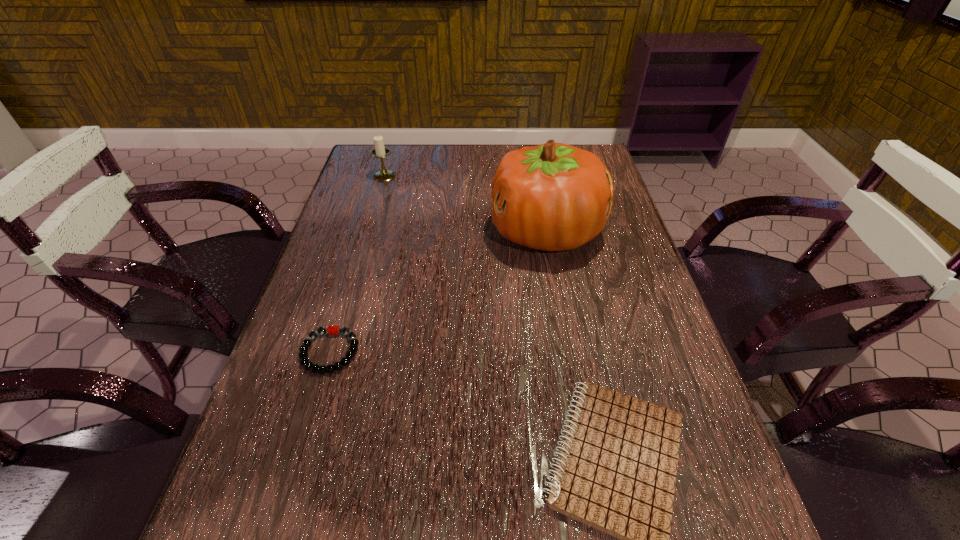
Identify the location of vacant space situated 0.230m on the right of the second nearest object. (474, 352).

Where is `object present at the far edge`? object present at the far edge is located at coordinates (380, 151).

Where is `candle holder present at the left edge`? This screenshot has width=960, height=540. candle holder present at the left edge is located at coordinates (380, 151).

Locate an element on the screen. The height and width of the screenshot is (540, 960). bracelet that is positioned at the left edge is located at coordinates pos(303,355).

Where is `object that is at the right edge`? The width and height of the screenshot is (960, 540). object that is at the right edge is located at coordinates (553, 197).

Find the location of `object present at the far left corner`. object present at the far left corner is located at coordinates (380, 151).

This screenshot has height=540, width=960. In order to click on vacant space at the far edge in this screenshot , I will do `click(473, 169)`.

The image size is (960, 540). I want to click on vacant space at the left edge of the desktop, so click(x=377, y=213).

This screenshot has width=960, height=540. Find the location of `vacant area at the right edge of the desktop`. vacant area at the right edge of the desktop is located at coordinates (595, 247).

The image size is (960, 540). In the image, there is a desktop. In order to click on vacant space at the far left corner in this screenshot , I will do `click(371, 147)`.